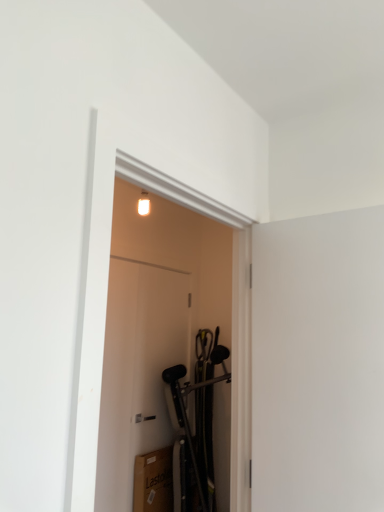
Question: From the image's perspective, is white matte door at center, which is counted as the 1th door, starting from the back, located above or below white matte screen door at right?

Choices:
 (A) below
 (B) above

Answer: (A)

Question: Which is correct: white matte door at center, which is the second door in front-to-back order, is inside white matte screen door at right, or outside of it?

Choices:
 (A) outside
 (B) inside

Answer: (A)

Question: Which object is positioned farthest from the white matte door at center, which is counted as the 1th door, starting from the back?

Choices:
 (A) white matte screen door at right
 (B) white glossy door at center, acting as the second door starting from the back

Answer: (A)

Question: Which object is positioned farthest from the white glossy door at center, acting as the second door starting from the back?

Choices:
 (A) white matte screen door at right
 (B) white matte door at center, which is counted as the 1th door, starting from the back

Answer: (A)